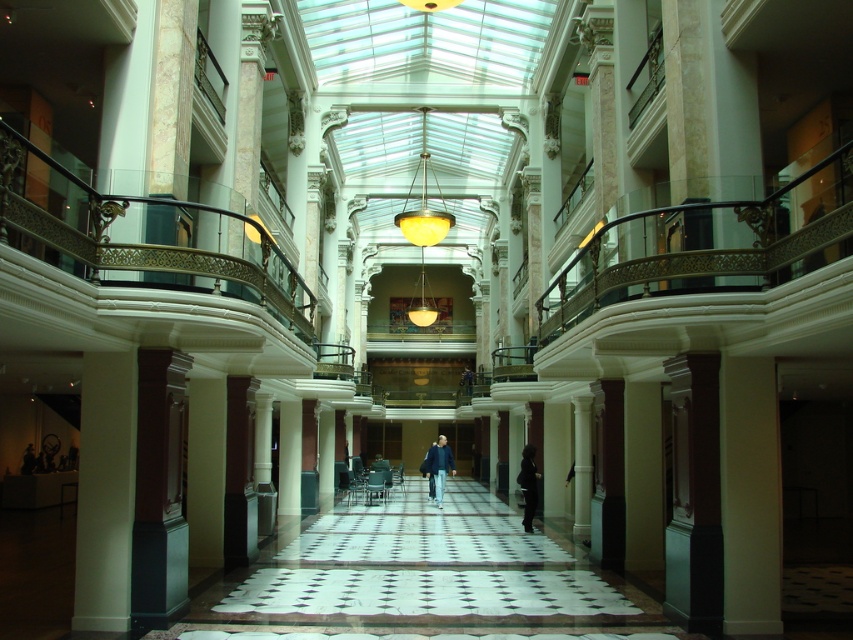
You are standing in the grand hall and see both the blue denim jacket at center and the dark gray fabric coat at center. Which one is positioned more to the left side of the hall?

The blue denim jacket at center is positioned more to the left side of the hall than the dark gray fabric coat at center.

You are standing in the grand hall and see two garments hanging on a rack at the center. The blue denim jacket at center and the dark gray fabric coat at center. Which one is positioned lower?

The blue denim jacket at center is below the dark gray fabric coat at center, so it is positioned lower.